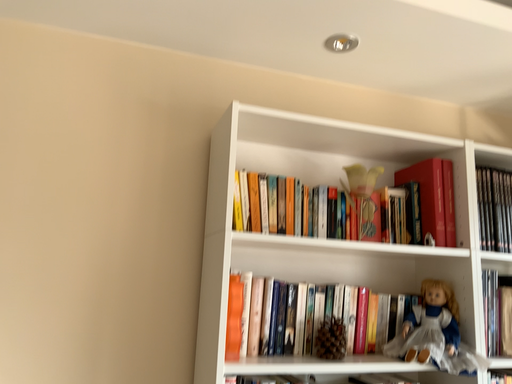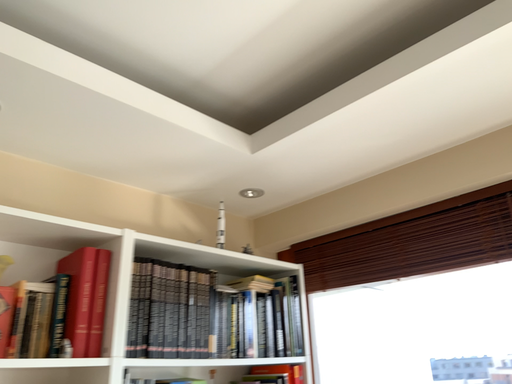
Question: Which way did the camera rotate in the video?

Choices:
 (A) rotated right
 (B) rotated left

Answer: (A)